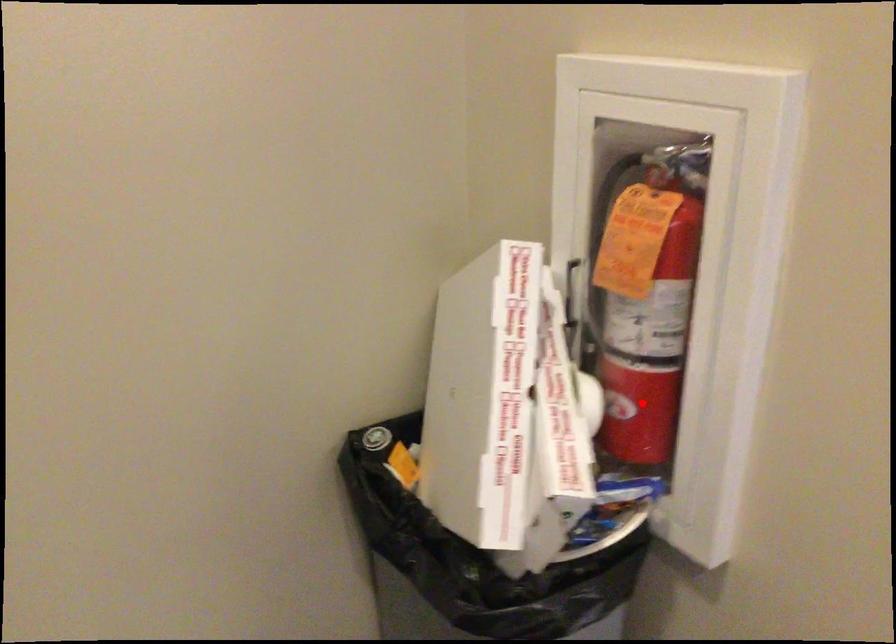
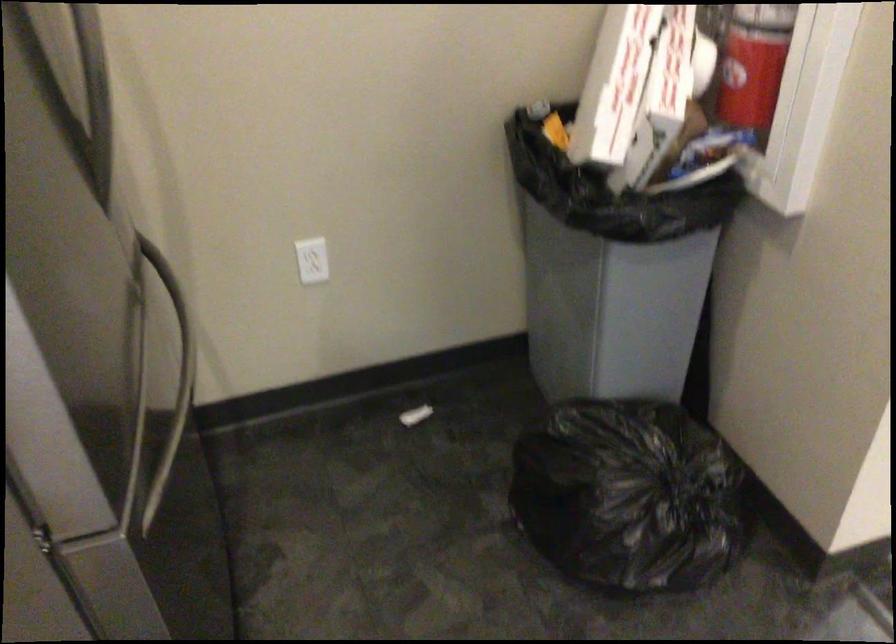
Where in the second image is the point corresponding to the highlighted location from the first image?

(754, 64)